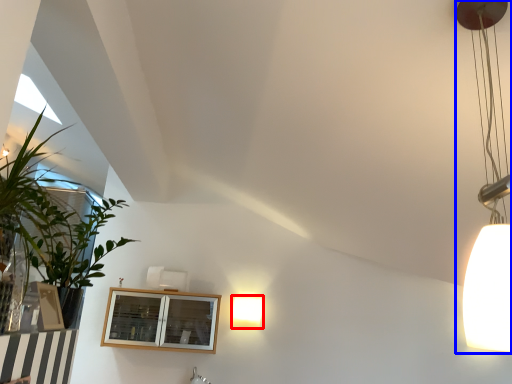
Question: Which point is further to the camera, lamp (highlighted by a red box) or lamp (highlighted by a blue box)?

Choices:
 (A) lamp
 (B) lamp

Answer: (A)